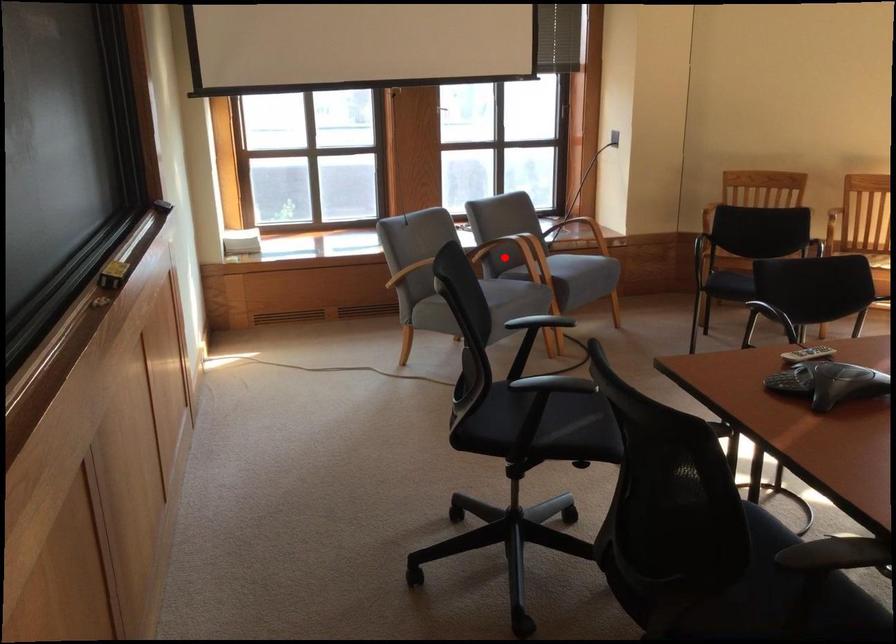
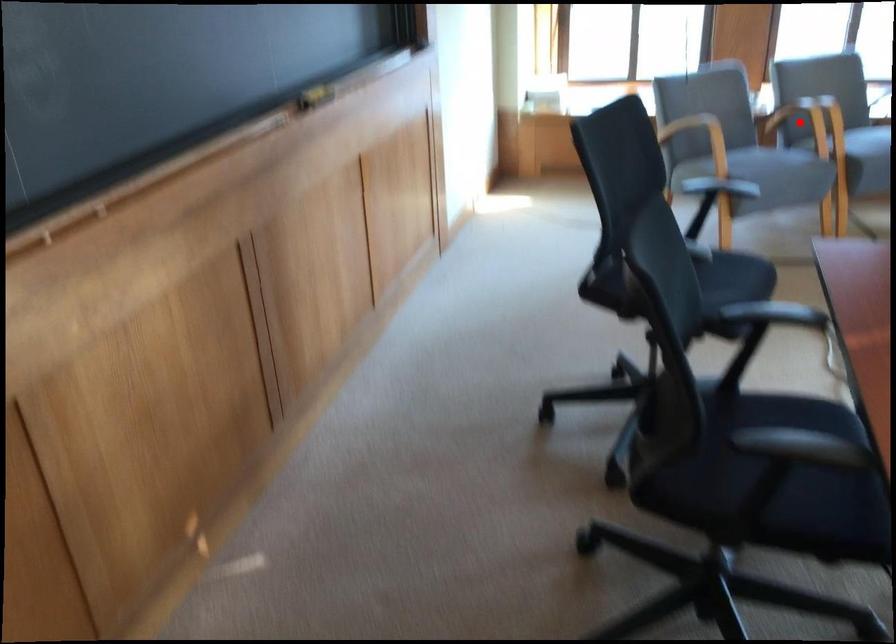
I am providing you with two images of the same scene from different viewpoints. A red point is marked on the first image and another point is marked on the second image. Are the points marked in image1 and image2 representing the same 3D position?

Yes